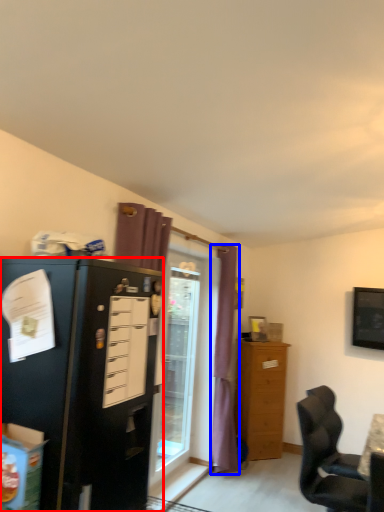
Question: Which point is further to the camera, cabinetry (highlighted by a red box) or curtain (highlighted by a blue box)?

Choices:
 (A) cabinetry
 (B) curtain

Answer: (B)